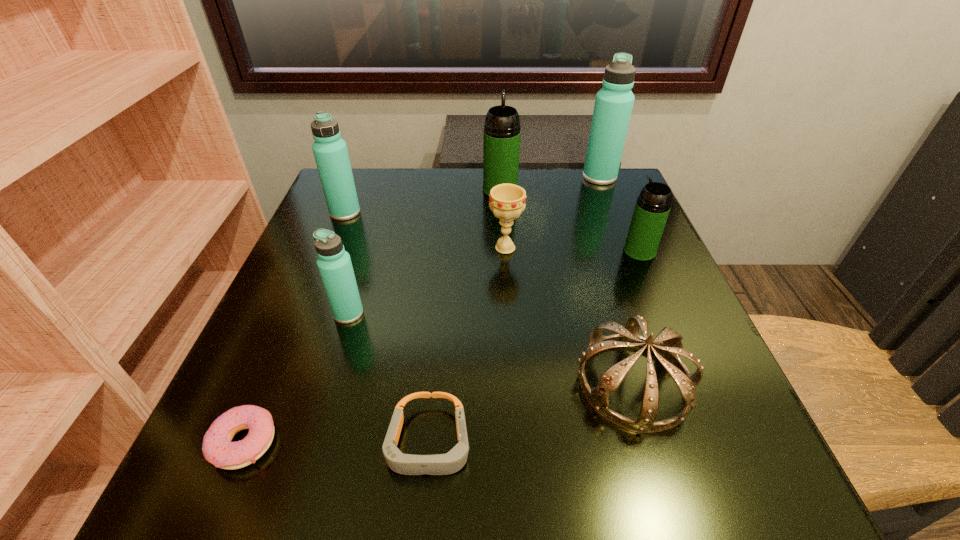
Where is `thermos bottle that is the third closest to the fourth object from left to right`? The width and height of the screenshot is (960, 540). thermos bottle that is the third closest to the fourth object from left to right is located at coordinates (330, 151).

Point out which aqua thermos bottle is positioned as the nearest to the goggles. Please provide its 2D coordinates. Your answer should be formatted as a tuple, i.e. [(x, y)], where the tuple contains the x and y coordinates of a point satisfying the conditions above.

[(334, 263)]

Find the location of a particular element. The width and height of the screenshot is (960, 540). aqua thermos bottle identified as the second closest to the third shortest object is located at coordinates (613, 106).

Where is `vacant space that satisfies the following two spatial constraints: 1. from the spout of the smaller green thermos bottle; 2. on the front and back of the fourth object from left to right`? The height and width of the screenshot is (540, 960). vacant space that satisfies the following two spatial constraints: 1. from the spout of the smaller green thermos bottle; 2. on the front and back of the fourth object from left to right is located at coordinates (722, 443).

I want to click on free space that satisfies the following two spatial constraints: 1. from the spout of the smaller green thermos bottle; 2. on the front and back of the sixth object from right to left, so click(x=722, y=443).